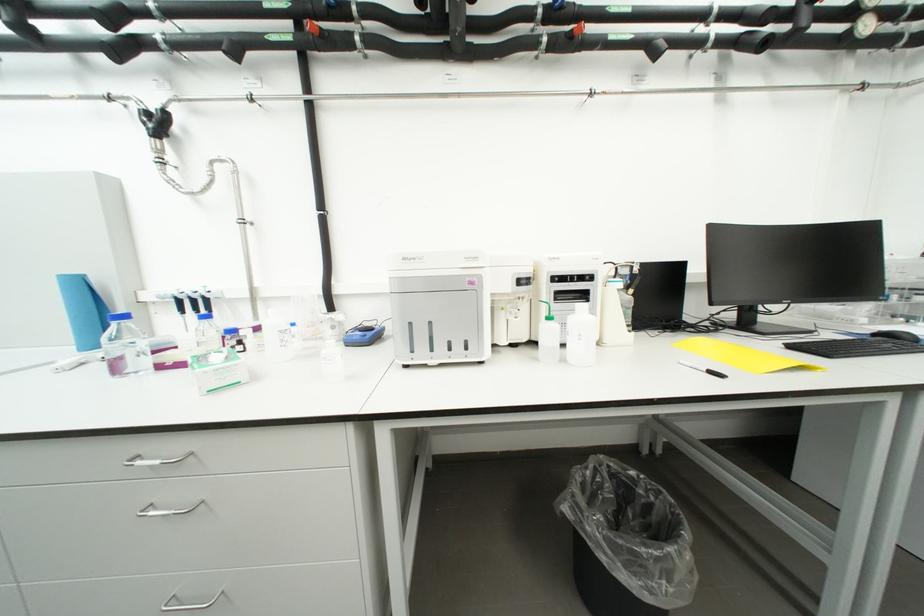
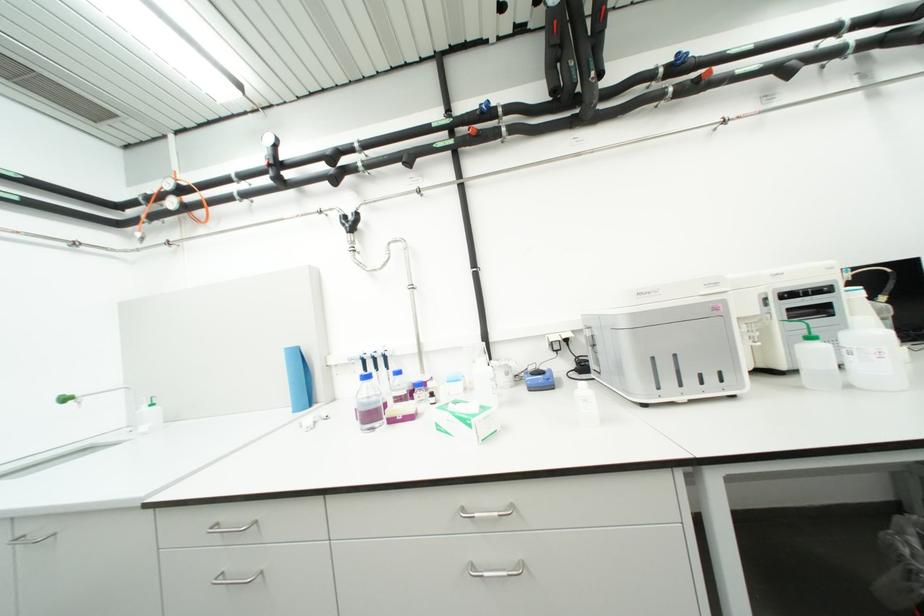
Find the pixel in the second image that matches the point at 572,362 in the first image.

(857, 387)